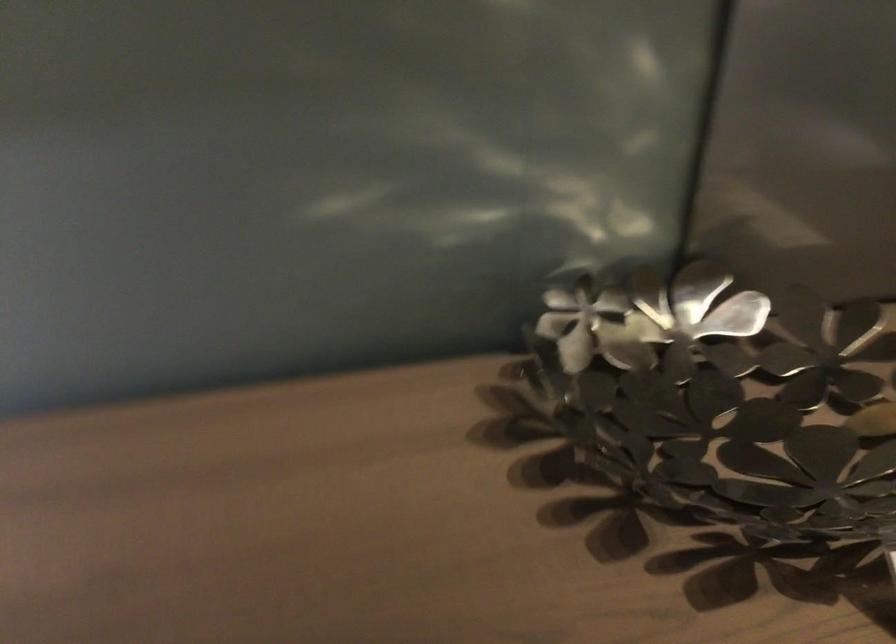
The location [721,399] corresponds to which object?

It refers to a metal flower bowl.